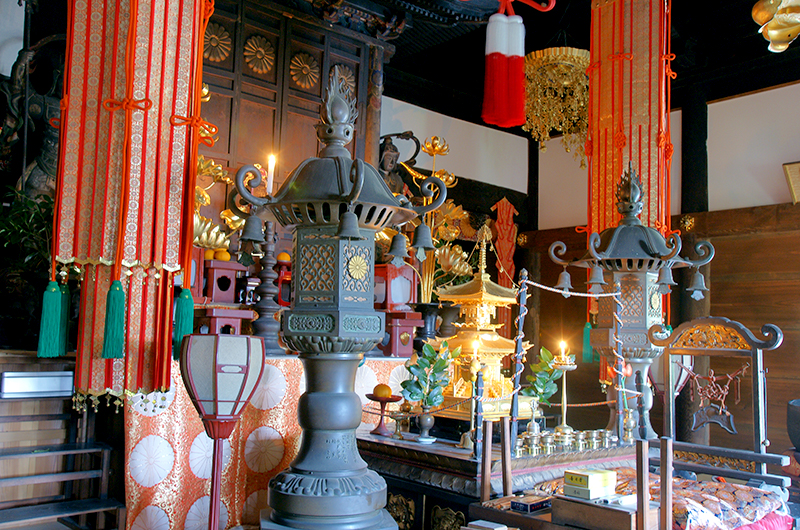
This screenshot has width=800, height=530. Identify the location of wall. point(234,110), point(762,277).